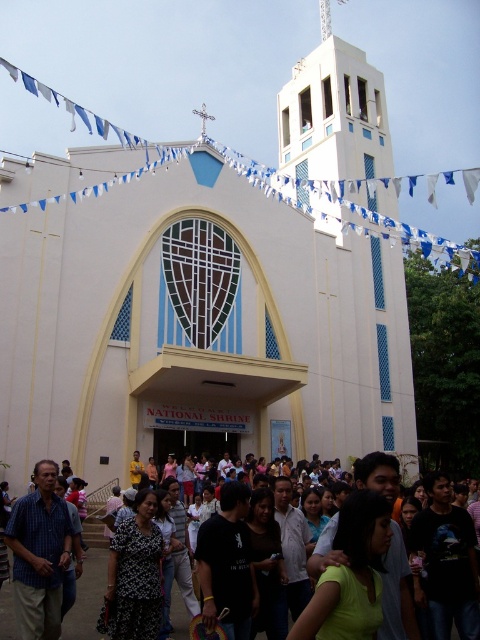
Can you confirm if white smooth church at center is positioned to the right of light green shirt at center?

No, white smooth church at center is not to the right of light green shirt at center.

The width and height of the screenshot is (480, 640). Identify the location of white smooth church at center. (206, 294).

Image resolution: width=480 pixels, height=640 pixels. What do you see at coordinates (206, 294) in the screenshot? I see `white smooth church at center` at bounding box center [206, 294].

Where is `white smooth church at center`? This screenshot has height=640, width=480. white smooth church at center is located at coordinates (206, 294).